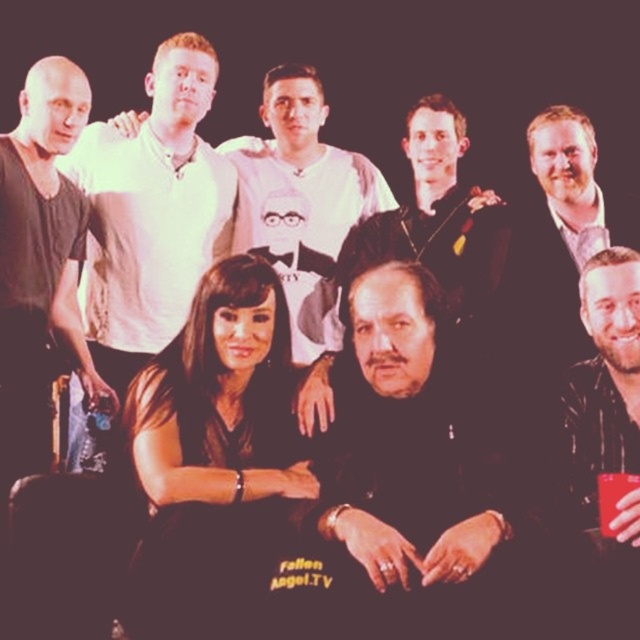
Measure the distance between point (22,220) and camera.

They are 2.84 meters apart.

Which is below, black matte suitcase at left or white matte shirt at upper center?

black matte suitcase at left is below.

Image resolution: width=640 pixels, height=640 pixels. Find the location of `black matte suitcase at left`. black matte suitcase at left is located at coordinates (40, 260).

Is black matte jacket at center bigger than matte white shirt at upper left?

A: Incorrect, black matte jacket at center is not larger than matte white shirt at upper left.

Does black matte jacket at center appear on the left side of matte white shirt at upper left?

No, black matte jacket at center is not to the left of matte white shirt at upper left.

This screenshot has height=640, width=640. What are the coordinates of `black matte jacket at center` in the screenshot? It's located at (406, 468).

Is shiny black jacket at lower right to the right of matte black shirt at center from the viewer's perspective?

Correct, you'll find shiny black jacket at lower right to the right of matte black shirt at center.

In the scene shown: Can you confirm if shiny black jacket at lower right is smaller than matte black shirt at center?

Incorrect, shiny black jacket at lower right is not smaller in size than matte black shirt at center.

Locate an element on the screen. The width and height of the screenshot is (640, 640). shiny black jacket at lower right is located at coordinates point(602,449).